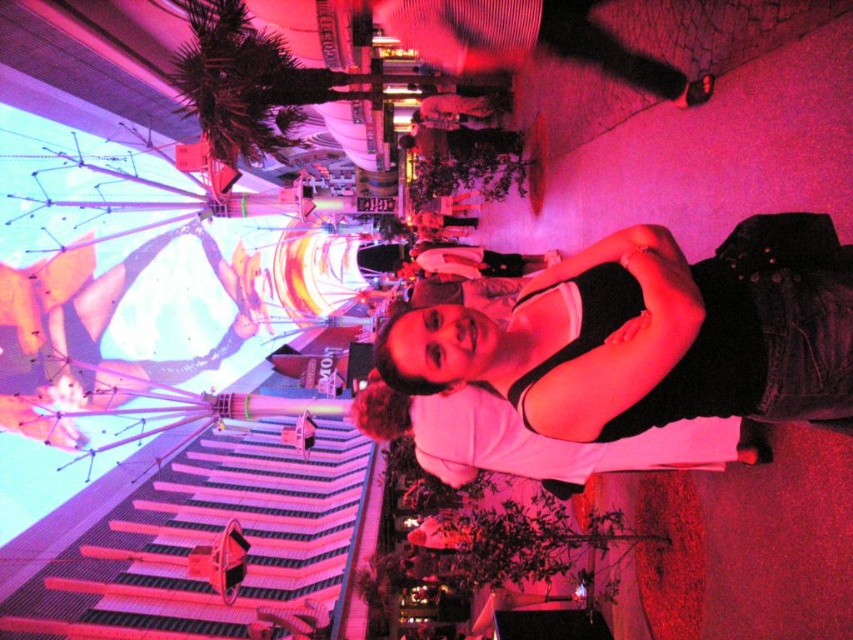
You are a fashion designer observing two outfits in the image. The outfits are the black denim jacket at center and the white matte shirt at center. Which one is located to the right of the other?

The black denim jacket at center is positioned on the right side of the white matte shirt at center.

You are a photographer standing in the urban night scene. You want to take a closeup shot of the black denim jacket at center. Considering your current position, can you estimate whether you need to move closer or farther away to achieve the desired closeup?

The black denim jacket at center is 19.60 meters away from the viewer. To take a closeup shot, you would need to move closer to reduce the distance between yourself and the jacket.

You are a fashion designer observing a street scene with two people wearing different tops. You need to determine which clothing item is shorter in height between the black denim jacket at center and the white matte shirt at center. Based on the scene, which one would you choose?

The black denim jacket at center is not as tall as the white matte shirt at center, so the black denim jacket at center is shorter in height.